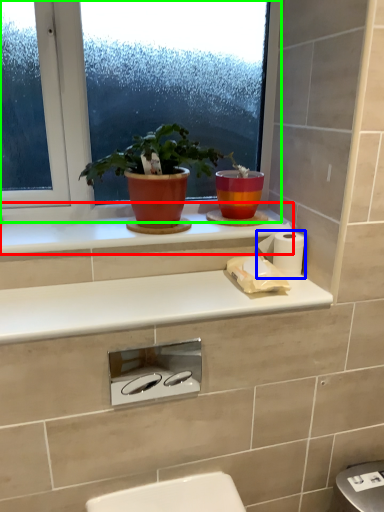
Question: Based on their relative distances, which object is nearer to window sill (highlighted by a red box)? Choose from toilet paper (highlighted by a blue box) and window (highlighted by a green box).

Choices:
 (A) toilet paper
 (B) window

Answer: (B)